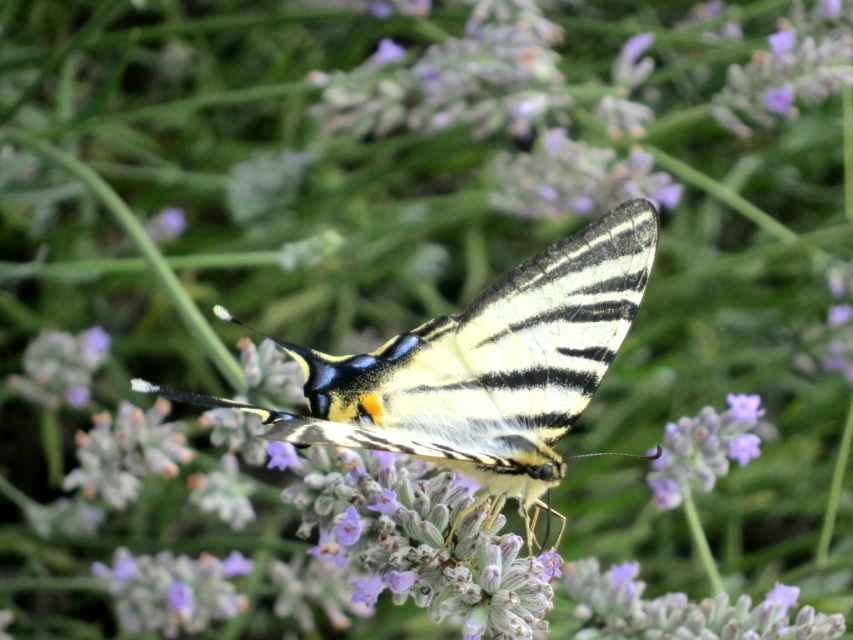
Question: Which object appears farthest from the camera in this image?

Choices:
 (A) shiny yellow and black butterfly at center
 (B) purple fuzzy lavender at center

Answer: (B)

Question: Can you confirm if shiny yellow and black butterfly at center is positioned to the right of purple fuzzy lavender at center?

Choices:
 (A) no
 (B) yes

Answer: (A)

Question: From the image, what is the correct spatial relationship of shiny yellow and black butterfly at center in relation to purple fuzzy lavender at center?

Choices:
 (A) above
 (B) below

Answer: (A)

Question: Which of the following is the closest to the observer?

Choices:
 (A) (550, 259)
 (B) (671, 456)

Answer: (A)

Question: In this image, where is shiny yellow and black butterfly at center located relative to purple fuzzy lavender at center?

Choices:
 (A) left
 (B) right

Answer: (A)